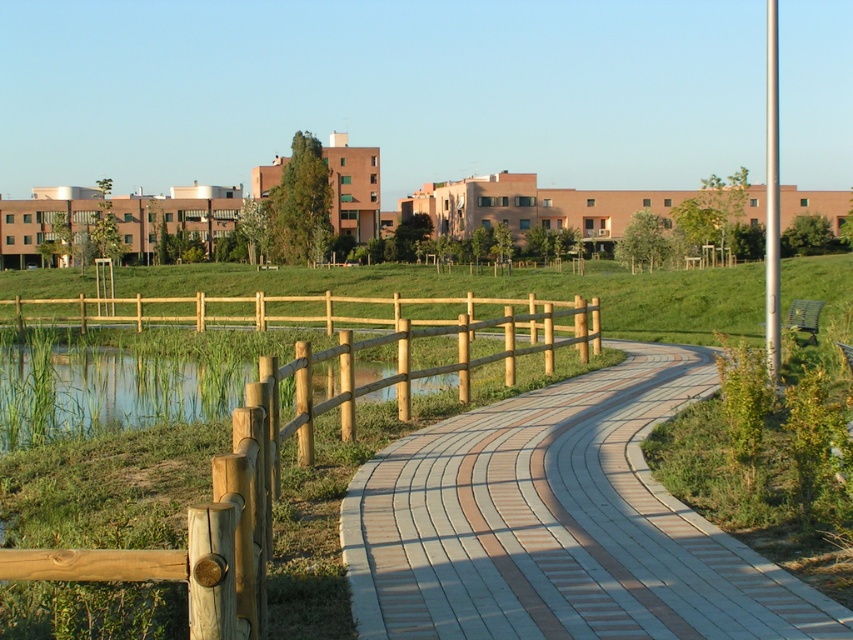
Question: Is brick paved path at center in front of wooden fence at left?

Choices:
 (A) no
 (B) yes

Answer: (A)

Question: Does brick paved path at center appear over wooden fence at left?

Choices:
 (A) no
 (B) yes

Answer: (A)

Question: Which point is closer to the camera?

Choices:
 (A) (260, 369)
 (B) (686, 403)

Answer: (A)

Question: Which point is farther to the camera?

Choices:
 (A) brick paved path at center
 (B) wooden fence at left

Answer: (A)

Question: Is brick paved path at center positioned in front of wooden fence at left?

Choices:
 (A) yes
 (B) no

Answer: (B)